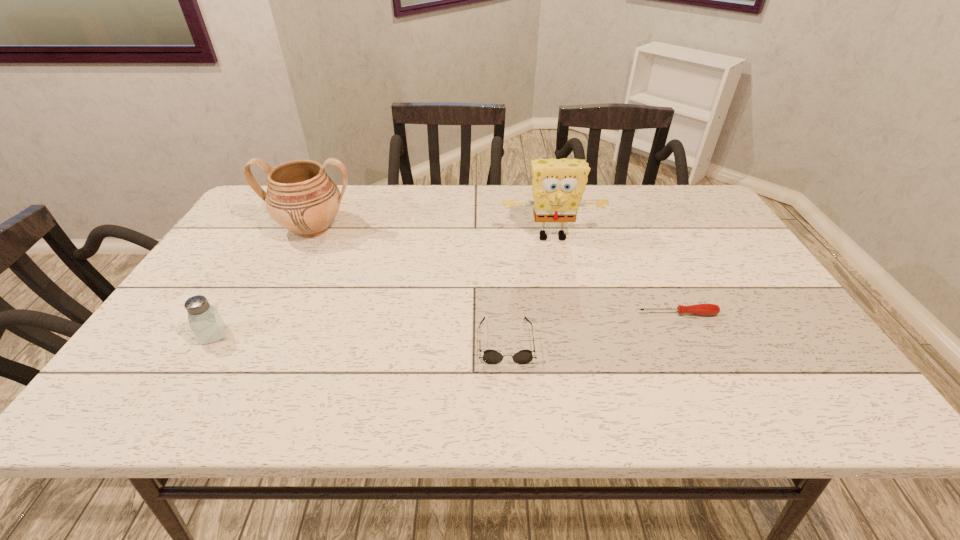
Locate an element on the screen. sponge is located at coordinates (558, 184).

Where is `urn`? urn is located at coordinates (301, 197).

You are a GUI agent. You are given a task and a screenshot of the screen. Output one action in this format:
    pyautogui.click(x=<x>, y=<y>)
    Task: Click on the third tallest object
    This screenshot has width=960, height=540.
    Given the screenshot: What is the action you would take?
    pyautogui.click(x=208, y=326)

At what (x,y) coordinates should I click in order to perform the action: click on sunglasses. Please return your answer as a coordinate pair (x, y). Image resolution: width=960 pixels, height=540 pixels. Looking at the image, I should click on (490, 356).

Where is `the shortest object`? the shortest object is located at coordinates (706, 309).

Locate an element on the screen. The image size is (960, 540). the third nearest object is located at coordinates click(706, 309).

Where is `free space located 0.290m on the face of the sponge`? This screenshot has height=540, width=960. free space located 0.290m on the face of the sponge is located at coordinates (570, 323).

The width and height of the screenshot is (960, 540). I want to click on vacant space located on the front-facing side of the urn, so pos(296,260).

The width and height of the screenshot is (960, 540). What are the coordinates of `free location located on the front of the third tallest object` in the screenshot? It's located at (189, 375).

This screenshot has height=540, width=960. I want to click on free region located on the front-facing side of the sunglasses, so click(x=509, y=385).